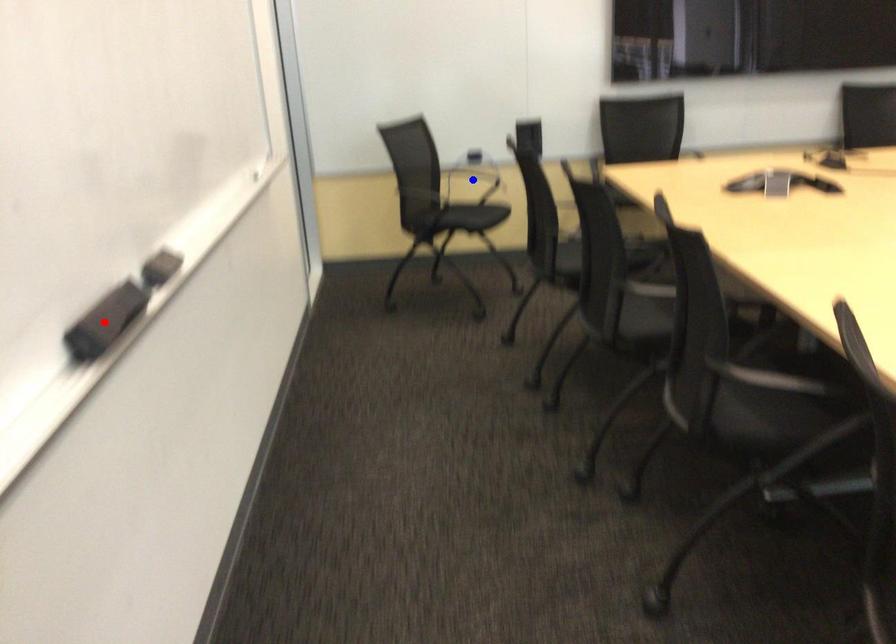
Question: In the image, two points are highlighted. Which point is nearer to the camera? Reply with the corresponding letter.

Choices:
 (A) blue point
 (B) red point

Answer: (B)